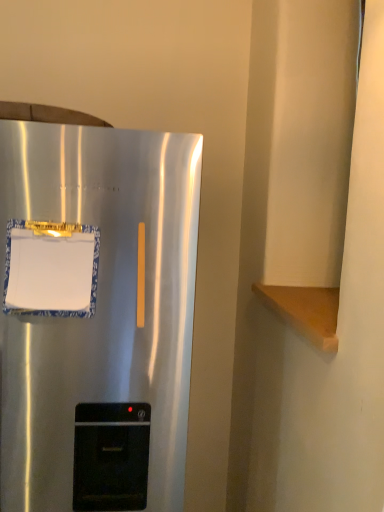
Question: Relative to white paper at left, is satin silver refrigerator at left in front or behind?

Choices:
 (A) front
 (B) behind

Answer: (A)

Question: Is point (19, 480) positioned closer to the camera than point (72, 230)?

Choices:
 (A) farther
 (B) closer

Answer: (A)

Question: From their relative heights in the image, would you say satin silver refrigerator at left is taller or shorter than white paper at left?

Choices:
 (A) tall
 (B) short

Answer: (A)

Question: In terms of size, does white paper at left appear bigger or smaller than satin silver refrigerator at left?

Choices:
 (A) big
 (B) small

Answer: (B)

Question: Considering the positions of white paper at left and satin silver refrigerator at left in the image, is white paper at left taller or shorter than satin silver refrigerator at left?

Choices:
 (A) tall
 (B) short

Answer: (B)

Question: Does point (43, 259) appear closer or farther from the camera than point (6, 343)?

Choices:
 (A) closer
 (B) farther

Answer: (A)

Question: Choose the correct answer: Is white paper at left inside satin silver refrigerator at left or outside it?

Choices:
 (A) inside
 (B) outside

Answer: (A)